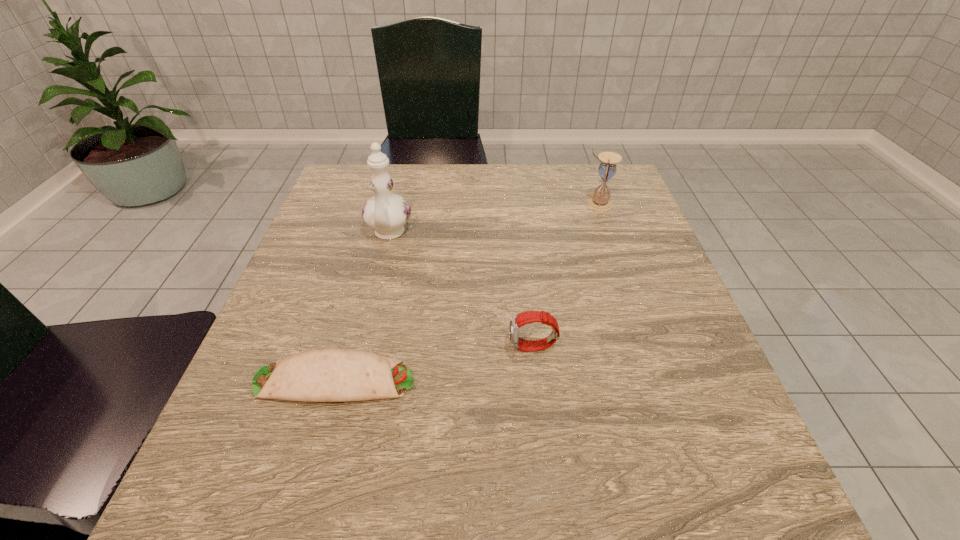
The width and height of the screenshot is (960, 540). I want to click on free space located on the face of the third tallest object, so click(x=322, y=348).

At what (x,y) coordinates should I click in order to perform the action: click on vacant space located 0.290m on the face of the third tallest object. Please return your answer as a coordinate pair (x, y). The image size is (960, 540). Looking at the image, I should click on (349, 348).

The width and height of the screenshot is (960, 540). Find the location of `free region located at the bitten end of the burrito`. free region located at the bitten end of the burrito is located at coordinates (586, 380).

The width and height of the screenshot is (960, 540). Find the location of `object that is at the far edge`. object that is at the far edge is located at coordinates (600, 201).

At what (x,y) coordinates should I click in order to perform the action: click on chinaware present at the left edge. Please return your answer as a coordinate pair (x, y). This screenshot has height=540, width=960. Looking at the image, I should click on (387, 213).

Identify the location of burrito that is positioned at the left edge. (327, 374).

Find the location of a particular element. The width and height of the screenshot is (960, 540). object located at the right edge is located at coordinates (600, 201).

Identify the location of object that is positioned at the far right corner. (600, 201).

At what (x,y) coordinates should I click in order to perform the action: click on vacant space at the far edge. Please return your answer as a coordinate pair (x, y). The height and width of the screenshot is (540, 960). Looking at the image, I should click on (396, 191).

Identify the location of vacant region at the near edge of the desktop. (351, 512).